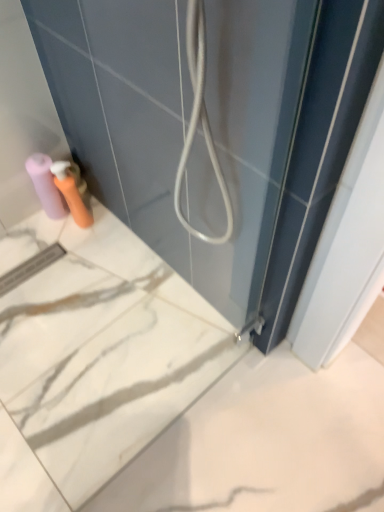
Question: Does matte pink toilet paper at lower left appear on the left side of matte plastic soap dispenser at lower left?

Choices:
 (A) yes
 (B) no

Answer: (A)

Question: Considering the relative sizes of matte pink toilet paper at lower left and matte plastic soap dispenser at lower left in the image provided, is matte pink toilet paper at lower left shorter than matte plastic soap dispenser at lower left?

Choices:
 (A) yes
 (B) no

Answer: (B)

Question: From a real-world perspective, is matte pink toilet paper at lower left under matte plastic soap dispenser at lower left?

Choices:
 (A) yes
 (B) no

Answer: (A)

Question: Is matte pink toilet paper at lower left at the right side of matte plastic soap dispenser at lower left?

Choices:
 (A) yes
 (B) no

Answer: (B)

Question: From the image's perspective, is matte pink toilet paper at lower left located above matte plastic soap dispenser at lower left?

Choices:
 (A) yes
 (B) no

Answer: (A)

Question: From a real-world perspective, is matte pink toilet paper at lower left on top of matte plastic soap dispenser at lower left?

Choices:
 (A) no
 (B) yes

Answer: (A)

Question: Can you confirm if matte plastic soap dispenser at lower left is bigger than matte pink toilet paper at lower left?

Choices:
 (A) no
 (B) yes

Answer: (A)

Question: Considering the relative positions of matte plastic soap dispenser at lower left and matte pink toilet paper at lower left in the image provided, is matte plastic soap dispenser at lower left behind matte pink toilet paper at lower left?

Choices:
 (A) no
 (B) yes

Answer: (A)

Question: Can we say matte plastic soap dispenser at lower left lies outside matte pink toilet paper at lower left?

Choices:
 (A) yes
 (B) no

Answer: (A)

Question: Can you confirm if matte plastic soap dispenser at lower left is taller than matte pink toilet paper at lower left?

Choices:
 (A) no
 (B) yes

Answer: (A)

Question: From a real-world perspective, is matte plastic soap dispenser at lower left on matte pink toilet paper at lower left?

Choices:
 (A) yes
 (B) no

Answer: (A)

Question: Does matte plastic soap dispenser at lower left have a greater width compared to matte pink toilet paper at lower left?

Choices:
 (A) no
 (B) yes

Answer: (A)

Question: Does point (29, 161) appear closer or farther from the camera than point (79, 205)?

Choices:
 (A) closer
 (B) farther

Answer: (A)